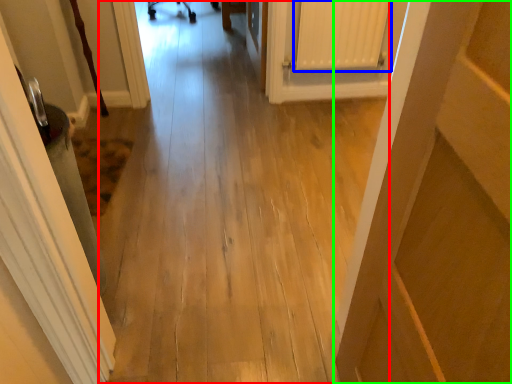
Question: Estimate the real-world distances between objects in this image. Which object is closer to path (highlighted by a red box), radiator (highlighted by a blue box) or door (highlighted by a green box)?

Choices:
 (A) radiator
 (B) door

Answer: (A)